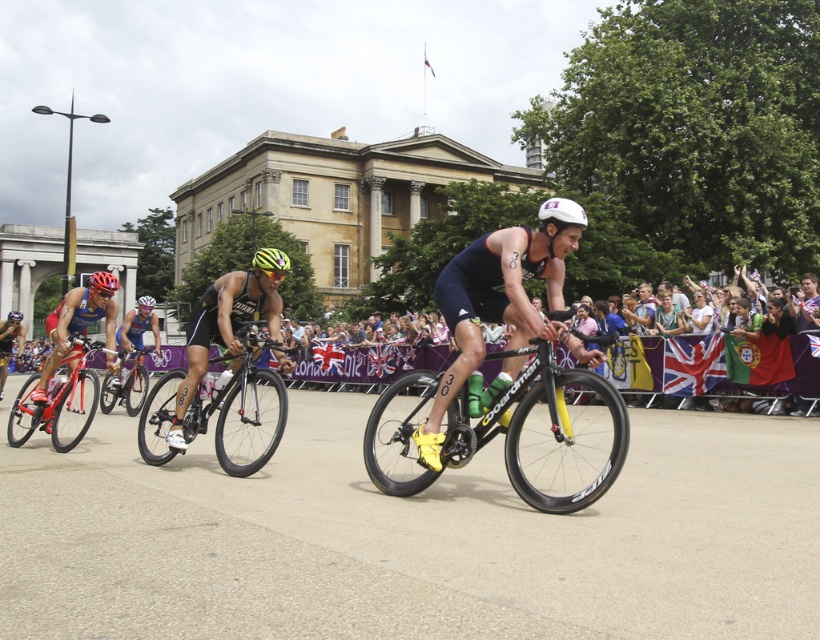
You are a photographer at the event and need to capture a closeup shot of the yellow matte bicycle helmet at center and the matte black helmet at center. Given that your camera lens can only focus on objects within a 15cm width range, will both helmets fit within this range if they are positioned side by side?

The yellow matte bicycle helmet at center is wider than the matte black helmet at center. Since the total width of both helmets together would exceed 15cm, they cannot both fit within the camera lens focus range of 15cm.

You are a spectator standing at the side of the road watching the triathlon cyclists. You see the black matte bicycle at center and the shiny red bicycle at left. Which bicycle is positioned lower in the image?

The black matte bicycle at center is located below the shiny red bicycle at left, so it is positioned lower in the image.

You are a photographer positioned at the side of the road during the triathlon. You need to capture a photo of the black matte bicycle at center and the shiny red bicycle at left. Given that your camera can only focus on objects within a 1.2 meter width, will both bicycles fit within the camera frame if they are side by side?

The black matte bicycle at center is wider than the shiny red bicycle at left. Since the total width of both bicycles together would exceed the camera frame width of 1.2 meters, they cannot both fit within the frame when placed side by side.